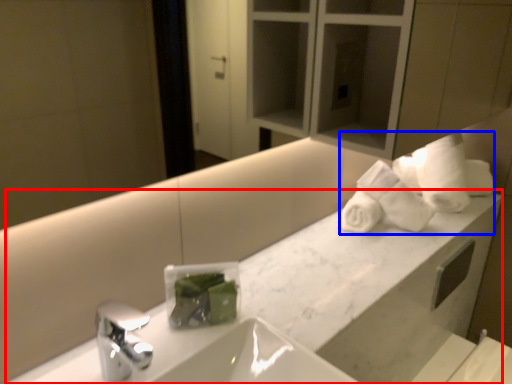
Question: Which object appears closest to the camera in this image, counter (highlighted by a red box) or bath towel (highlighted by a blue box)?

Choices:
 (A) counter
 (B) bath towel

Answer: (A)